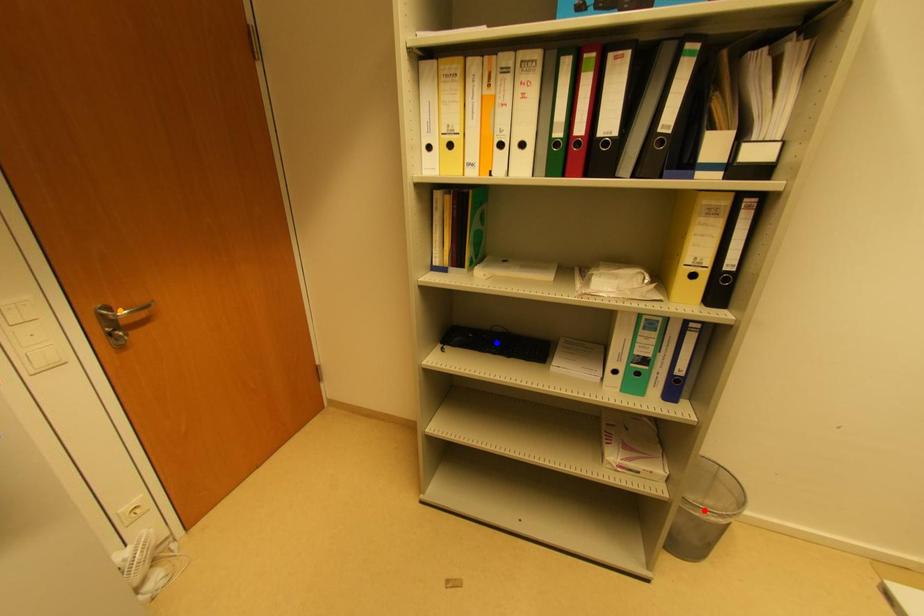
Order these from nearest to farthest:
orange point, red point, blue point

blue point
red point
orange point